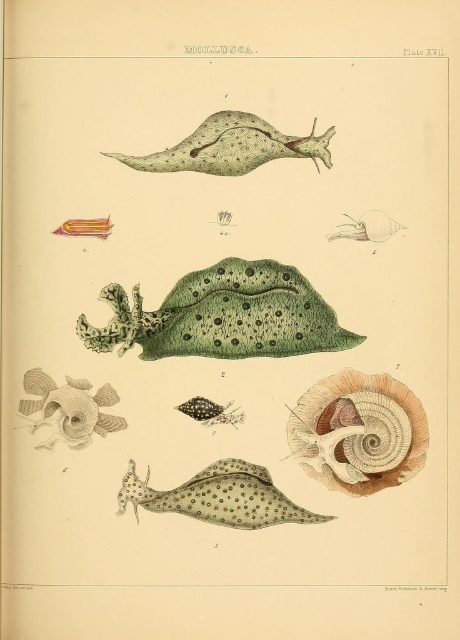
Question: Based on their relative distances, which object is nearer to the speckled green slug at center?

Choices:
 (A) speckled green slug at upper center
 (B) green matte slug at center
 (C) black dotted shell at center

Answer: (C)

Question: Which object is positioned farthest from the speckled green slug at center?

Choices:
 (A) brown textured shell at center
 (B) smooth brown shell at center

Answer: (A)

Question: Among these points, which one is farthest from the camera?

Choices:
 (A) (229, 499)
 (B) (201, 413)
 (C) (316, 436)
 (D) (90, 419)

Answer: (B)

Question: Does green matte slug at center have a smaller size compared to brown textured shell at center?

Choices:
 (A) no
 (B) yes

Answer: (A)

Question: Is green matte slug at center thinner than smooth brown shell at center?

Choices:
 (A) yes
 (B) no

Answer: (B)

Question: Does green matte slug at center appear over speckled green slug at center?

Choices:
 (A) no
 (B) yes

Answer: (B)